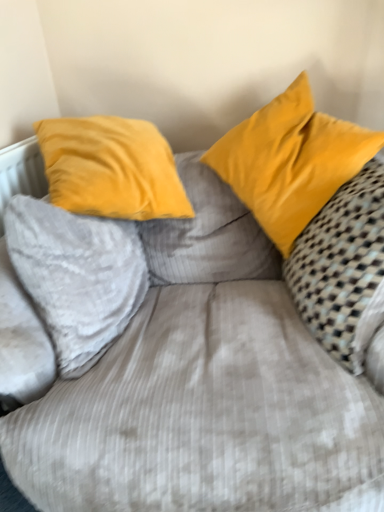
Locate an element on the screen. The width and height of the screenshot is (384, 512). velvet yellow pillow at upper left, the 3th pillow in the right-to-left sequence is located at coordinates coord(77,276).

What are the coordinates of `velvet yellow pillow at right, the third pillow in the left-to-right sequence` in the screenshot? It's located at (340, 260).

Image resolution: width=384 pixels, height=512 pixels. I want to click on yellow velvet pillow at upper right, marked as the 2th pillow in a left-to-right arrangement, so click(290, 161).

Does yellow velvet pillow at upper right, marked as the 2th pillow in a left-to-right arrangement, turn towards velvet yellow pillow at right, which is the 1th pillow from right to left?

Yes.

Which is behind, yellow velvet pillow at upper right, marked as the 2th pillow in a left-to-right arrangement, or velvet yellow pillow at right, the third pillow in the left-to-right sequence?

yellow velvet pillow at upper right, marked as the 2th pillow in a left-to-right arrangement, is behind.

Considering the sizes of objects yellow velvet pillow at upper right, marked as the 2th pillow in a left-to-right arrangement, and velvet yellow pillow at right, which is the 1th pillow from right to left, in the image provided, who is taller, yellow velvet pillow at upper right, marked as the 2th pillow in a left-to-right arrangement, or velvet yellow pillow at right, which is the 1th pillow from right to left,?

velvet yellow pillow at right, which is the 1th pillow from right to left, is taller.

Measure the distance between yellow velvet pillow at upper right, which is the second pillow in right-to-left order, and velvet yellow pillow at right, the third pillow in the left-to-right sequence.

They are 7.66 inches apart.

Based on the photo, is velvet yellow pillow at right, which is the 1th pillow from right to left, wider than yellow velvet pillow at upper right, marked as the 2th pillow in a left-to-right arrangement?

No.

Based on the photo, is velvet yellow pillow at right, which is the 1th pillow from right to left, directly adjacent to yellow velvet pillow at upper right, marked as the 2th pillow in a left-to-right arrangement?

No.

Does velvet yellow pillow at right, which is the 1th pillow from right to left, have a smaller size compared to yellow velvet pillow at upper right, marked as the 2th pillow in a left-to-right arrangement?

No.

From the image's perspective, is velvet yellow pillow at right, which is the 1th pillow from right to left, above or below yellow velvet pillow at upper right, which is the second pillow in right-to-left order?

velvet yellow pillow at right, which is the 1th pillow from right to left, is below yellow velvet pillow at upper right, which is the second pillow in right-to-left order.

Which is closer to the camera, (307, 308) or (33, 259)?

Point (307, 308).

From a real-world perspective, is velvet yellow pillow at right, the third pillow in the left-to-right sequence, beneath velvet yellow pillow at upper left, the 3th pillow in the right-to-left sequence?

Indeed, from a real-world perspective, velvet yellow pillow at right, the third pillow in the left-to-right sequence, is positioned beneath velvet yellow pillow at upper left, the 3th pillow in the right-to-left sequence.

Is velvet yellow pillow at right, the third pillow in the left-to-right sequence, inside or outside of velvet yellow pillow at upper left, the 3th pillow in the right-to-left sequence?

velvet yellow pillow at right, the third pillow in the left-to-right sequence, is not inside velvet yellow pillow at upper left, the 3th pillow in the right-to-left sequence, it's outside.

Are velvet yellow pillow at upper left, the 3th pillow in the right-to-left sequence, and velvet yellow pillow at right, the third pillow in the left-to-right sequence, located far from each other?

No, velvet yellow pillow at upper left, the 3th pillow in the right-to-left sequence, is in close proximity to velvet yellow pillow at right, the third pillow in the left-to-right sequence.

Is velvet yellow pillow at upper left, the 3th pillow in the right-to-left sequence, behind velvet yellow pillow at right, the third pillow in the left-to-right sequence?

Yes.

From the picture: From the image's perspective, does velvet yellow pillow at upper left, the 3th pillow in the right-to-left sequence, appear lower than velvet yellow pillow at right, which is the 1th pillow from right to left?

Yes.

Between velvet yellow pillow at upper left, the 1th pillow when ordered from left to right, and yellow velvet pillow at upper right, marked as the 2th pillow in a left-to-right arrangement, which one is positioned in front?

velvet yellow pillow at upper left, the 1th pillow when ordered from left to right, is closer to the camera.

In terms of size, does velvet yellow pillow at upper left, the 3th pillow in the right-to-left sequence, appear bigger or smaller than yellow velvet pillow at upper right, which is the second pillow in right-to-left order?

Clearly, velvet yellow pillow at upper left, the 3th pillow in the right-to-left sequence, is smaller in size than yellow velvet pillow at upper right, which is the second pillow in right-to-left order.

Looking at this image, is velvet yellow pillow at upper left, the 3th pillow in the right-to-left sequence, wider or thinner than yellow velvet pillow at upper right, which is the second pillow in right-to-left order?

In the image, velvet yellow pillow at upper left, the 3th pillow in the right-to-left sequence, appears to be more narrow than yellow velvet pillow at upper right, which is the second pillow in right-to-left order.

Is point (21, 278) less distant than point (312, 192)?

Yes, it is in front of point (312, 192).

Could velvet yellow pillow at upper left, the 3th pillow in the right-to-left sequence, be considered to be inside yellow velvet pillow at upper right, marked as the 2th pillow in a left-to-right arrangement?

No, velvet yellow pillow at upper left, the 3th pillow in the right-to-left sequence, is not surrounded by yellow velvet pillow at upper right, marked as the 2th pillow in a left-to-right arrangement.

At what (x,y) coordinates should I click in order to perform the action: click on the 2nd pillow above when counting from the velvet yellow pillow at upper left, the 3th pillow in the right-to-left sequence (from the image's perspective). Please return your answer as a coordinate pair (x, y). The width and height of the screenshot is (384, 512). Looking at the image, I should click on (290, 161).

From a real-world perspective, is yellow velvet pillow at upper right, marked as the 2th pillow in a left-to-right arrangement, on velvet yellow pillow at upper left, the 1th pillow when ordered from left to right?

Yes.

Considering the relative sizes of yellow velvet pillow at upper right, marked as the 2th pillow in a left-to-right arrangement, and velvet yellow pillow at upper left, the 3th pillow in the right-to-left sequence, in the image provided, is yellow velvet pillow at upper right, marked as the 2th pillow in a left-to-right arrangement, shorter than velvet yellow pillow at upper left, the 3th pillow in the right-to-left sequence,?

In fact, yellow velvet pillow at upper right, marked as the 2th pillow in a left-to-right arrangement, may be taller than velvet yellow pillow at upper left, the 3th pillow in the right-to-left sequence.

This screenshot has height=512, width=384. What are the coordinates of `pillow that is the 2nd object located in front of the yellow velvet pillow at upper right, marked as the 2th pillow in a left-to-right arrangement` in the screenshot? It's located at (340, 260).

Which pillow is the 2nd one when counting from the back of the velvet yellow pillow at right, which is the 1th pillow from right to left? Please provide its 2D coordinates.

[(290, 161)]

Based on their spatial positions, is velvet yellow pillow at upper left, the 1th pillow when ordered from left to right, or yellow velvet pillow at upper right, which is the second pillow in right-to-left order, closer to velvet yellow pillow at right, the third pillow in the left-to-right sequence?

yellow velvet pillow at upper right, which is the second pillow in right-to-left order, lies closer to velvet yellow pillow at right, the third pillow in the left-to-right sequence, than the other object.

Looking at the image, which one is located closer to yellow velvet pillow at upper right, marked as the 2th pillow in a left-to-right arrangement, velvet yellow pillow at right, the third pillow in the left-to-right sequence, or velvet yellow pillow at upper left, the 1th pillow when ordered from left to right?

The object closer to yellow velvet pillow at upper right, marked as the 2th pillow in a left-to-right arrangement, is velvet yellow pillow at right, the third pillow in the left-to-right sequence.

Which object lies nearer to the anchor point yellow velvet pillow at upper right, marked as the 2th pillow in a left-to-right arrangement, velvet yellow pillow at upper left, the 3th pillow in the right-to-left sequence, or velvet yellow pillow at right, which is the 1th pillow from right to left?

Among the two, velvet yellow pillow at right, which is the 1th pillow from right to left, is located nearer to yellow velvet pillow at upper right, marked as the 2th pillow in a left-to-right arrangement.

Which object lies nearer to the anchor point velvet yellow pillow at upper left, the 1th pillow when ordered from left to right, yellow velvet pillow at upper right, which is the second pillow in right-to-left order, or velvet yellow pillow at right, the third pillow in the left-to-right sequence?

Among the two, yellow velvet pillow at upper right, which is the second pillow in right-to-left order, is located nearer to velvet yellow pillow at upper left, the 1th pillow when ordered from left to right.

Estimate the real-world distances between objects in this image. Which object is further from velvet yellow pillow at right, the third pillow in the left-to-right sequence, yellow velvet pillow at upper right, which is the second pillow in right-to-left order, or velvet yellow pillow at upper left, the 1th pillow when ordered from left to right?

velvet yellow pillow at upper left, the 1th pillow when ordered from left to right, lies further to velvet yellow pillow at right, the third pillow in the left-to-right sequence, than the other object.

Considering their positions, is velvet yellow pillow at right, the third pillow in the left-to-right sequence, positioned closer to velvet yellow pillow at upper left, the 1th pillow when ordered from left to right, than yellow velvet pillow at upper right, marked as the 2th pillow in a left-to-right arrangement?

yellow velvet pillow at upper right, marked as the 2th pillow in a left-to-right arrangement.

Locate an element on the screen. The width and height of the screenshot is (384, 512). pillow between velvet yellow pillow at upper left, the 1th pillow when ordered from left to right, and velvet yellow pillow at right, which is the 1th pillow from right to left, in the horizontal direction is located at coordinates (290, 161).